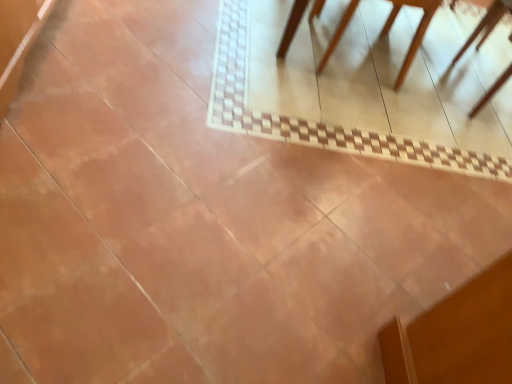
Question: From a real-world perspective, is brown wooden chair at upper right physically below light brown wooden table at upper right?

Choices:
 (A) no
 (B) yes

Answer: (B)

Question: Is there a large distance between brown wooden chair at upper right and light brown wooden table at upper right?

Choices:
 (A) no
 (B) yes

Answer: (A)

Question: Would you say light brown wooden table at upper right is part of brown wooden chair at upper right's contents?

Choices:
 (A) no
 (B) yes

Answer: (A)

Question: From a real-world perspective, does brown wooden chair at upper right stand above light brown wooden table at upper right?

Choices:
 (A) no
 (B) yes

Answer: (A)

Question: Can you confirm if brown wooden chair at upper right is taller than light brown wooden table at upper right?

Choices:
 (A) yes
 (B) no

Answer: (B)

Question: Is brown wooden chair at upper right outside of light brown wooden table at upper right?

Choices:
 (A) yes
 (B) no

Answer: (B)

Question: Is light brown wooden table at upper right directly adjacent to brown wooden chair at upper right?

Choices:
 (A) no
 (B) yes

Answer: (A)

Question: Can you confirm if light brown wooden table at upper right is taller than brown wooden chair at upper right?

Choices:
 (A) no
 (B) yes

Answer: (B)

Question: From a real-world perspective, is light brown wooden table at upper right over brown wooden chair at upper right?

Choices:
 (A) no
 (B) yes

Answer: (B)

Question: Is brown wooden chair at upper right a part of light brown wooden table at upper right?

Choices:
 (A) no
 (B) yes

Answer: (B)

Question: Could you tell me if light brown wooden table at upper right is facing brown wooden chair at upper right?

Choices:
 (A) no
 (B) yes

Answer: (B)

Question: From the image's perspective, is light brown wooden table at upper right above brown wooden chair at upper right?

Choices:
 (A) no
 (B) yes

Answer: (B)

Question: In the image, is light brown wooden table at upper right positioned in front of or behind brown wooden chair at upper right?

Choices:
 (A) front
 (B) behind

Answer: (A)